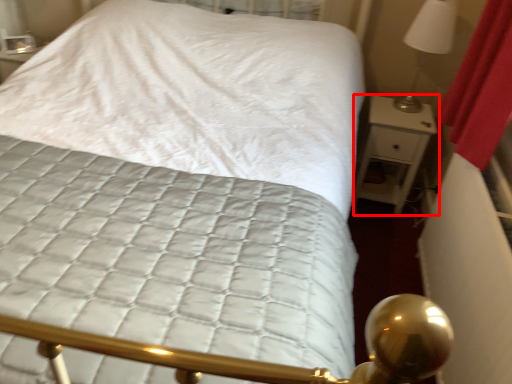
Question: In this image, where is nightstand (annotated by the red box) located relative to bedside lamp?

Choices:
 (A) right
 (B) left

Answer: (B)